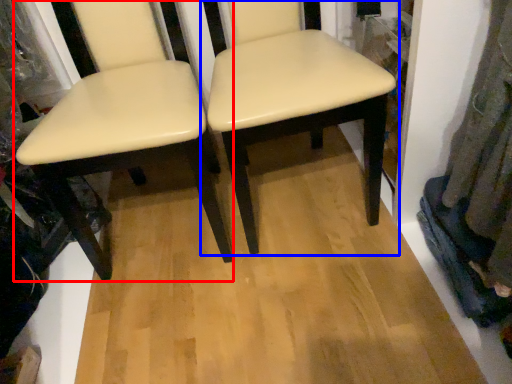
Question: Which object appears farthest to the camera in this image, chair (highlighted by a red box) or chair (highlighted by a blue box)?

Choices:
 (A) chair
 (B) chair

Answer: (B)